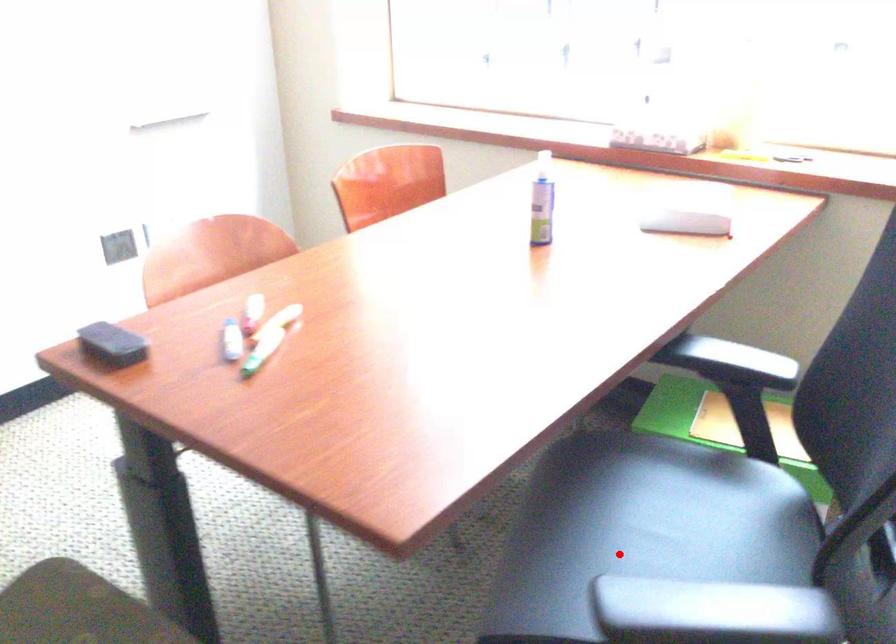
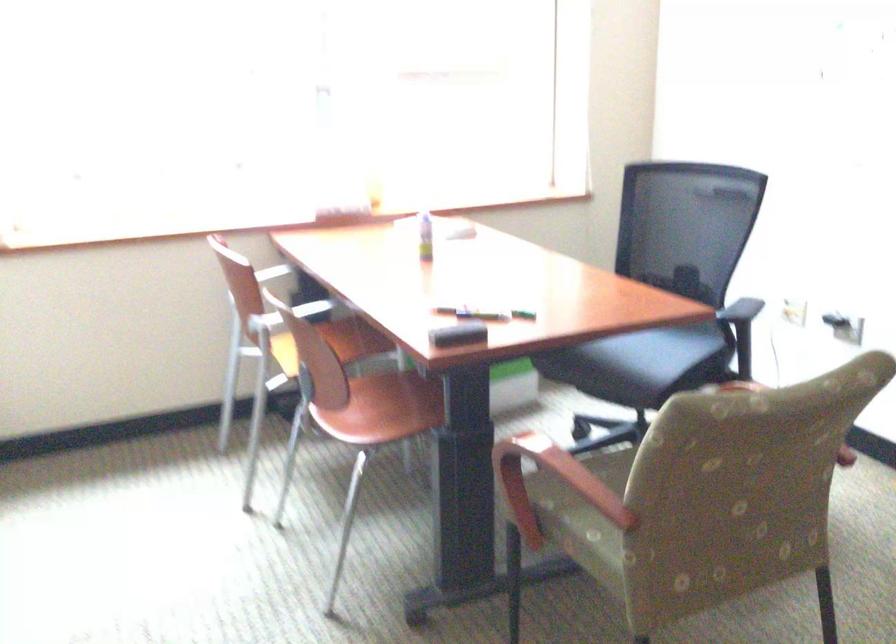
In the second image, find the point that corresponds to the highlighted location in the first image.

(649, 348)